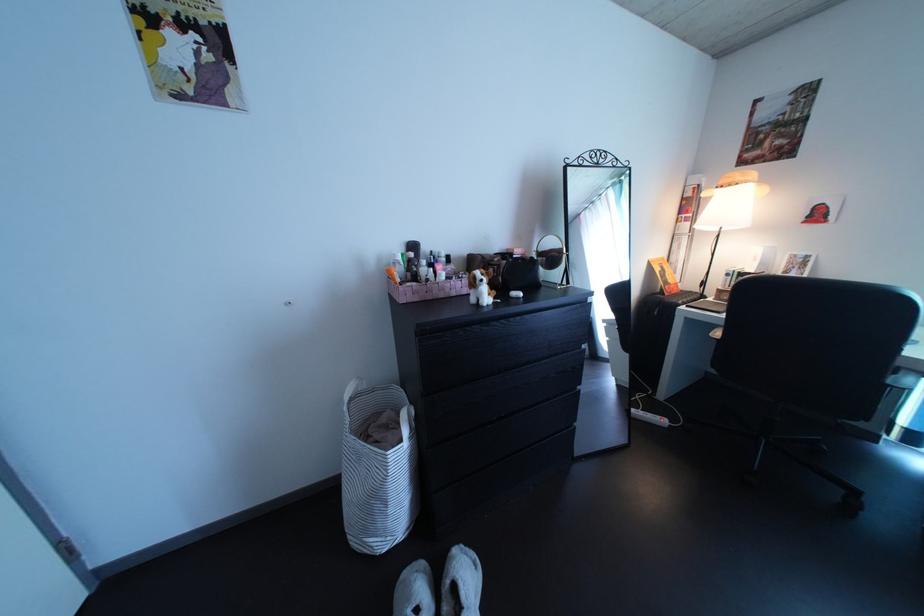
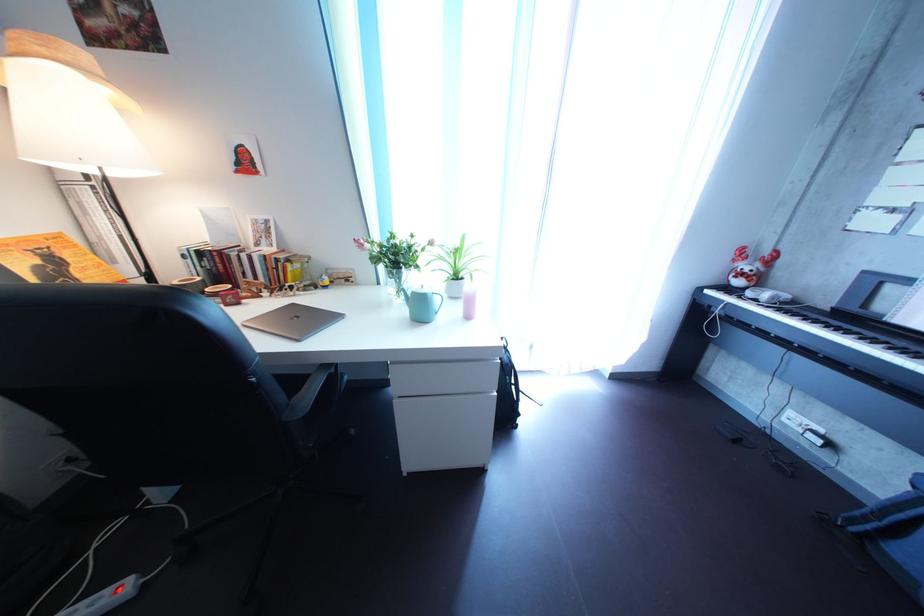
In the second image, find the point that corresponds to (x=673, y=424) in the first image.

(122, 601)